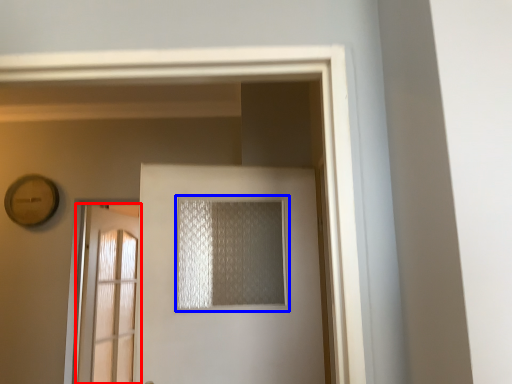
Question: Which object is closer to the camera taking this photo, door (highlighted by a red box) or window (highlighted by a blue box)?

Choices:
 (A) door
 (B) window

Answer: (B)